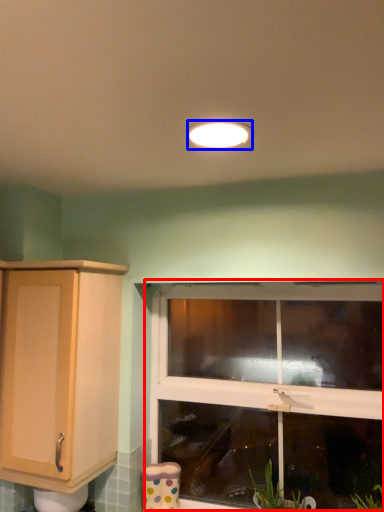
Question: Which object is closer to the camera taking this photo, window (highlighted by a red box) or light fixture (highlighted by a blue box)?

Choices:
 (A) window
 (B) light fixture

Answer: (B)